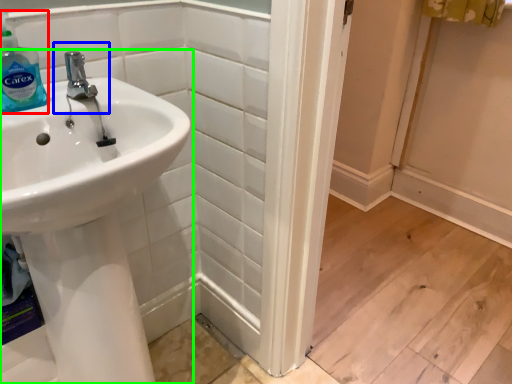
Question: Which object is positioned closest to cleaning product (highlighted by a red box)? Select from plumbing fixture (highlighted by a blue box) and sink (highlighted by a green box).

Choices:
 (A) plumbing fixture
 (B) sink

Answer: (A)